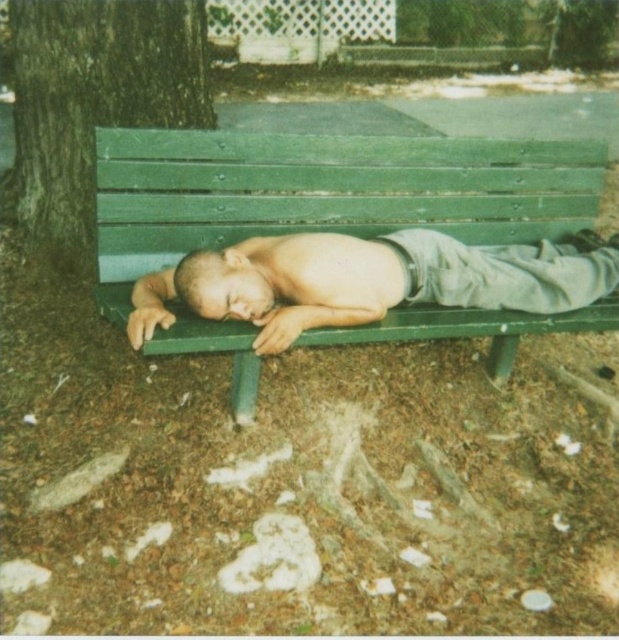
Question: Among these objects, which one is nearest to the camera?

Choices:
 (A) green rough bark at left
 (B) smooth skin man at center

Answer: (B)

Question: Is the position of green rough bark at left more distant than that of smooth skin man at center?

Choices:
 (A) yes
 (B) no

Answer: (A)

Question: Which of the following is the closest to the observer?

Choices:
 (A) (371, 289)
 (B) (113, 60)

Answer: (A)

Question: Is green rough bark at left smaller than smooth skin man at center?

Choices:
 (A) yes
 (B) no

Answer: (B)

Question: Among these points, which one is nearest to the camera?

Choices:
 (A) (139, 67)
 (B) (300, 292)

Answer: (B)

Question: Is green rough bark at left further to camera compared to smooth skin man at center?

Choices:
 (A) no
 (B) yes

Answer: (B)